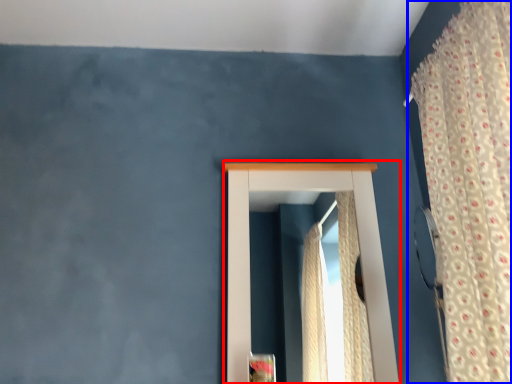
Question: Which object is further to the camera taking this photo, window (highlighted by a red box) or curtain (highlighted by a blue box)?

Choices:
 (A) window
 (B) curtain

Answer: (A)